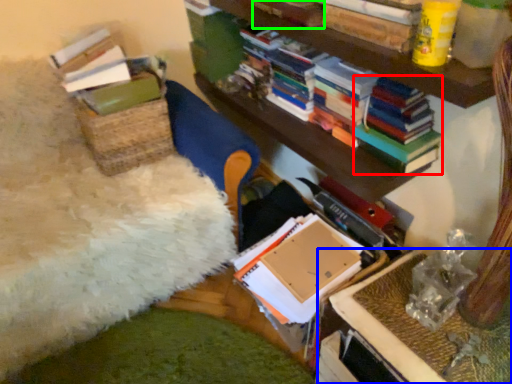
Question: Based on their relative distances, which object is nearer to magazine (highlighted by a red box)? Choose from table (highlighted by a blue box) and book (highlighted by a green box).

Choices:
 (A) table
 (B) book

Answer: (B)